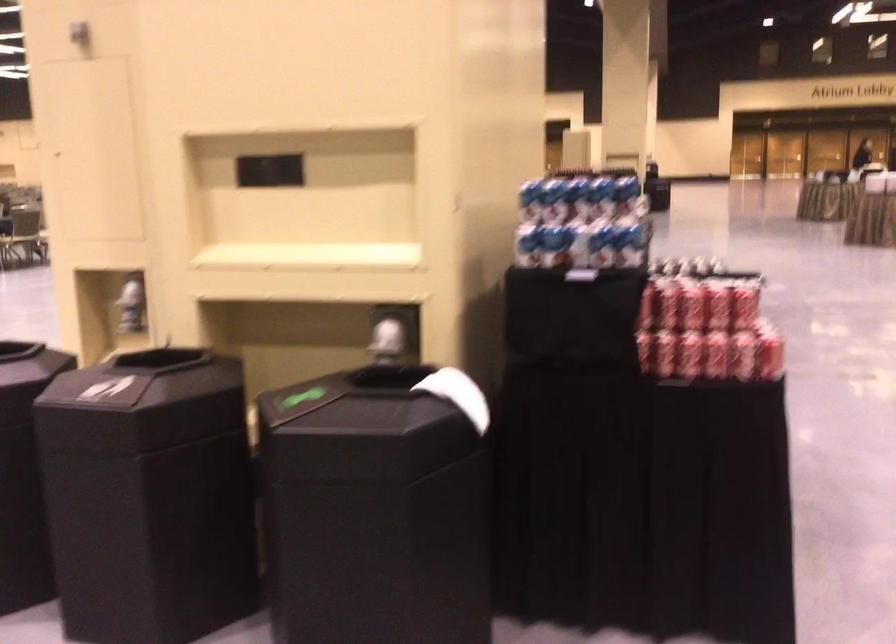
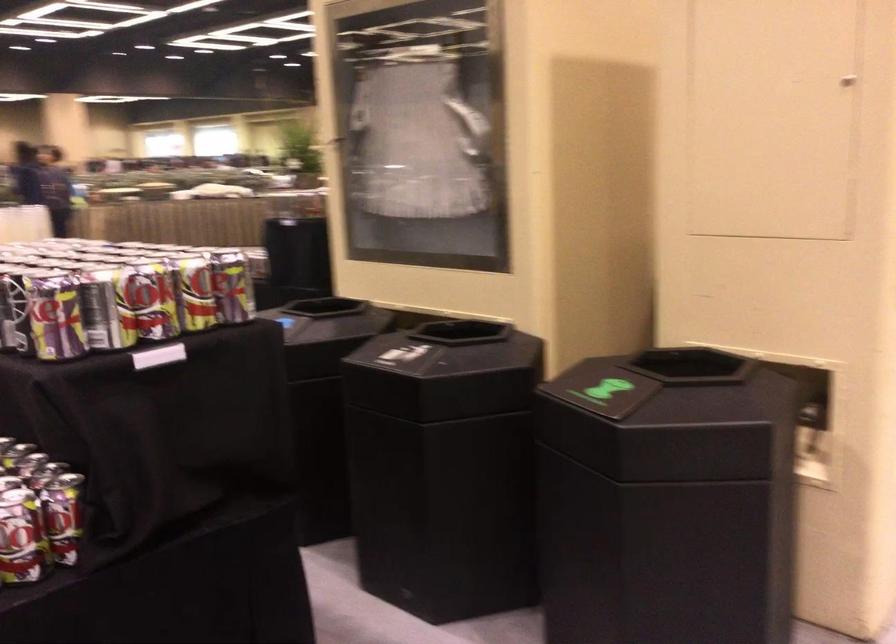
Question: I am providing you with two images of the same scene from different viewpoints. After the viewpoint changes to image2, which objects are now occluded?

Choices:
 (A) red pen holder
 (B) beverage can
 (C) blue and white can
 (D) black bin opening

Answer: (C)